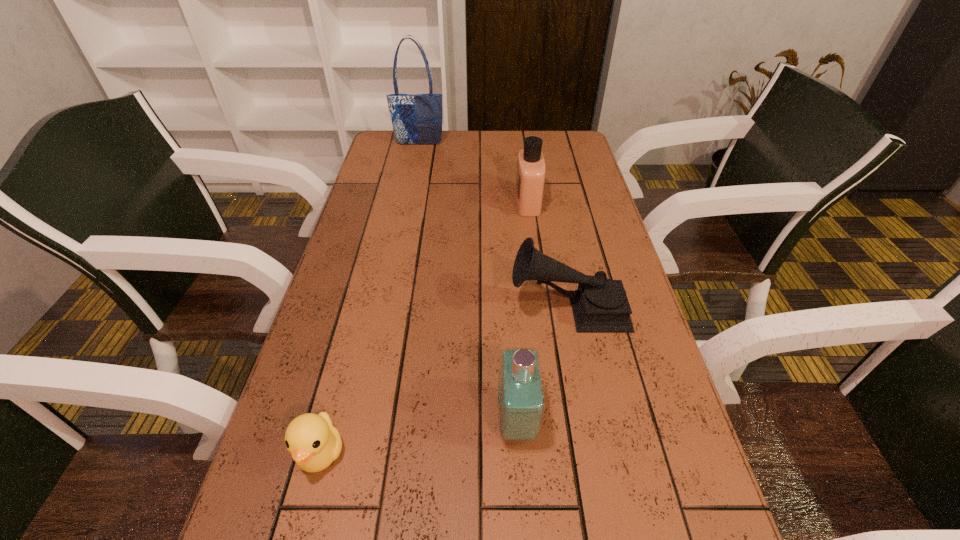
Where is `free space between the nearer perfume and the tallest object`? free space between the nearer perfume and the tallest object is located at coordinates (468, 283).

I want to click on vacant space in between the second farthest object and the nearer perfume, so click(x=522, y=312).

This screenshot has width=960, height=540. I want to click on unoccupied position between the farther perfume and the shortest object, so click(424, 327).

Where is `vacant space that's between the third farthest object and the right perfume`? vacant space that's between the third farthest object and the right perfume is located at coordinates (548, 255).

Where is `free spot between the third nearest object and the second farthest object`? The width and height of the screenshot is (960, 540). free spot between the third nearest object and the second farthest object is located at coordinates (548, 255).

This screenshot has width=960, height=540. What are the coordinates of `unoccupied position between the shortest object and the nearer perfume` in the screenshot? It's located at (419, 437).

This screenshot has height=540, width=960. In order to click on vacant space in between the shortest object and the shopping bag in this screenshot , I will do `click(370, 299)`.

Identify which object is the nearest to the phonograph_record. Please provide its 2D coordinates. Your answer should be formatted as a tuple, i.e. [(x, y)], where the tuple contains the x and y coordinates of a point satisfying the conditions above.

[(521, 397)]

At what (x,y) coordinates should I click in order to perform the action: click on object that is the third closest to the phonograph_record. Please return your answer as a coordinate pair (x, y). The image size is (960, 540). Looking at the image, I should click on (314, 443).

Where is `vacant position in the image that satisfies the following two spatial constraints: 1. on the front label of the nearer perfume; 2. on the face of the shortest object`? This screenshot has height=540, width=960. vacant position in the image that satisfies the following two spatial constraints: 1. on the front label of the nearer perfume; 2. on the face of the shortest object is located at coordinates (518, 453).